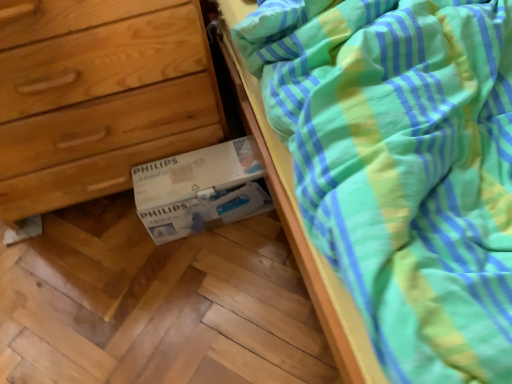
Where is `vacant space that is to the left of white cardboard box at lower center`? This screenshot has height=384, width=512. vacant space that is to the left of white cardboard box at lower center is located at coordinates (114, 246).